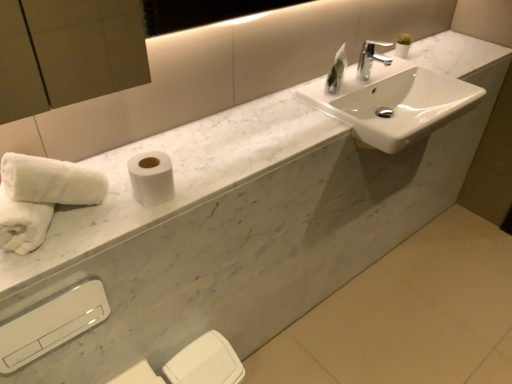
Identify the location of white marble counter top at center. coord(175,179).

In order to face white glossy hand dryer at lower left, should I rotate leftwards or rightwards?

To face it directly, rotate left by 25.039 degrees.

I want to click on white matte toilet paper at center, positioned as the 1th toilet paper in front-to-back order, so click(151, 178).

At what (x,y) coordinates should I click in order to perform the action: click on white matte toilet paper at lower center, marked as the second toilet paper in a front-to-back arrangement. Please return your answer as a coordinate pair (x, y). Looking at the image, I should click on (205, 362).

Where is `white glossy sink at upper right`? The height and width of the screenshot is (384, 512). white glossy sink at upper right is located at coordinates (394, 102).

Find the location of `chrome metallic faucet at upper center`. chrome metallic faucet at upper center is located at coordinates (371, 58).

Can you confirm if white glossy hand dryer at lower left is taller than white matte toilet paper at lower center, which is the 1th toilet paper from back to front?

No.

Who is more distant, white glossy hand dryer at lower left or white matte toilet paper at lower center, which is the 1th toilet paper from back to front?

white matte toilet paper at lower center, which is the 1th toilet paper from back to front, is more distant.

What's the angular difference between white glossy hand dryer at lower left and white matte toilet paper at lower center, the 2th toilet paper viewed from the top,'s facing directions?

The angular difference between white glossy hand dryer at lower left and white matte toilet paper at lower center, the 2th toilet paper viewed from the top, is 0.0031 degrees.

From the picture: Could you tell me if white glossy hand dryer at lower left is facing white matte toilet paper at lower center, marked as the second toilet paper in a front-to-back arrangement?

No, white glossy hand dryer at lower left is not facing towards white matte toilet paper at lower center, marked as the second toilet paper in a front-to-back arrangement.

How distant is white marble counter top at center from white fluffy towels at lower left?

The distance of white marble counter top at center from white fluffy towels at lower left is 14.55 inches.

Which object is thinner, white marble counter top at center or white fluffy towels at lower left?

With smaller width is white fluffy towels at lower left.

Which object is closer to the camera, white marble counter top at center or white fluffy towels at lower left?

white marble counter top at center is closer to the camera.

Could you tell me if white marble counter top at center is turned towards white fluffy towels at lower left?

No, white marble counter top at center is not facing towards white fluffy towels at lower left.

Is green glass vase at upper center facing away from white fluffy towels at lower left?

No, green glass vase at upper center's orientation is not away from white fluffy towels at lower left.

In the scene shown: Is white fluffy towels at lower left completely or partially inside green glass vase at upper center?

Definitely not — white fluffy towels at lower left is not inside green glass vase at upper center.

From a real-world perspective, is green glass vase at upper center physically below white fluffy towels at lower left?

No, from a real-world perspective, green glass vase at upper center is not under white fluffy towels at lower left.

From the picture: Are green glass vase at upper center and white fluffy towels at lower left beside each other?

There is a gap between green glass vase at upper center and white fluffy towels at lower left.

Which object is positioned more to the right, white fluffy towels at lower left or white matte toilet paper at center, positioned as the 1th toilet paper in front-to-back order?

Positioned to the right is white matte toilet paper at center, positioned as the 1th toilet paper in front-to-back order.

Is white fluffy towels at lower left not within white matte toilet paper at center, which ranks as the 2th toilet paper in bottom-to-top order?

white fluffy towels at lower left lies outside white matte toilet paper at center, which ranks as the 2th toilet paper in bottom-to-top order,'s area.

How many degrees apart are the facing directions of white fluffy towels at lower left and white matte toilet paper at center, the first toilet paper when ordered from top to bottom?

The facing directions of white fluffy towels at lower left and white matte toilet paper at center, the first toilet paper when ordered from top to bottom, are 35.7 degrees apart.

In the scene shown: Between white fluffy towels at lower left and white matte toilet paper at center, the first toilet paper when ordered from top to bottom, which one is positioned behind?

Positioned behind is white matte toilet paper at center, the first toilet paper when ordered from top to bottom.

Is chrome metallic faucet at upper center in front of white fluffy towels at lower left?

No.

Is white fluffy towels at lower left completely or partially inside chrome metallic faucet at upper center?

That's incorrect, white fluffy towels at lower left is not inside chrome metallic faucet at upper center.

Which object is positioned more to the right, chrome metallic faucet at upper center or white fluffy towels at lower left?

From the viewer's perspective, chrome metallic faucet at upper center appears more on the right side.

From the image's perspective, which one is positioned higher, white fluffy towels at lower left or white glossy sink at upper right?

white glossy sink at upper right.

From a real-world perspective, is white fluffy towels at lower left physically below white glossy sink at upper right?

Incorrect, from a real-world perspective, white fluffy towels at lower left is higher than white glossy sink at upper right.

Considering the sizes of objects white fluffy towels at lower left and white glossy sink at upper right in the image provided, who is smaller, white fluffy towels at lower left or white glossy sink at upper right?

With smaller size is white fluffy towels at lower left.

Considering the positions of points (6, 250) and (355, 72), is point (6, 250) closer to camera compared to point (355, 72)?

Yes, point (6, 250) is in front of point (355, 72).

From the image's perspective, is white matte toilet paper at lower center, marked as the second toilet paper in a front-to-back arrangement, beneath white glossy sink at upper right?

Yes, from the image's perspective, white matte toilet paper at lower center, marked as the second toilet paper in a front-to-back arrangement, is below white glossy sink at upper right.

Are white matte toilet paper at lower center, the 2th toilet paper viewed from the top, and white glossy sink at upper right beside each other?

No, white matte toilet paper at lower center, the 2th toilet paper viewed from the top, is not making contact with white glossy sink at upper right.

From a real-world perspective, is white matte toilet paper at lower center, marked as the second toilet paper in a front-to-back arrangement, physically below white glossy sink at upper right?

Indeed, from a real-world perspective, white matte toilet paper at lower center, marked as the second toilet paper in a front-to-back arrangement, is positioned beneath white glossy sink at upper right.

Is white matte toilet paper at lower center, placed as the 1th toilet paper when sorted from bottom to top, positioned with its back to white glossy sink at upper right?

No, white matte toilet paper at lower center, placed as the 1th toilet paper when sorted from bottom to top,'s orientation is not away from white glossy sink at upper right.

This screenshot has width=512, height=384. Identify the location of the 2nd toilet paper counting from the right of the white glossy hand dryer at lower left. (205, 362).

At what (x,y) coordinates should I click in order to perform the action: click on counter top above the white fluffy towels at lower left (from the image's perspective). Please return your answer as a coordinate pair (x, y). This screenshot has height=384, width=512. Looking at the image, I should click on (175, 179).

Consider the image. Which object lies nearer to the anchor point white glossy sink at upper right, white fluffy towels at lower left or white matte toilet paper at lower center, marked as the second toilet paper in a front-to-back arrangement?

white matte toilet paper at lower center, marked as the second toilet paper in a front-to-back arrangement, lies closer to white glossy sink at upper right than the other object.

Looking at the image, which one is located closer to white glossy hand dryer at lower left, white marble counter top at center or chrome metallic faucet at upper center?

white marble counter top at center lies closer to white glossy hand dryer at lower left than the other object.

When comparing their distances from white matte toilet paper at lower center, marked as the second toilet paper in a front-to-back arrangement, does chrome metallic faucet at upper center or white marble counter top at center seem further?

The object further to white matte toilet paper at lower center, marked as the second toilet paper in a front-to-back arrangement, is chrome metallic faucet at upper center.

From the image, which object appears to be nearer to white fluffy towels at lower left, white glossy hand dryer at lower left or white marble counter top at center?

white marble counter top at center lies closer to white fluffy towels at lower left than the other object.

Considering their positions, is chrome metallic faucet at upper center positioned closer to white glossy hand dryer at lower left than white glossy sink at upper right?

The object closer to white glossy hand dryer at lower left is white glossy sink at upper right.

Looking at the image, which one is located closer to white matte toilet paper at center, which ranks as the 2th toilet paper in bottom-to-top order, white glossy hand dryer at lower left or white glossy sink at upper right?

white glossy hand dryer at lower left lies closer to white matte toilet paper at center, which ranks as the 2th toilet paper in bottom-to-top order, than the other object.

When comparing their distances from white fluffy towels at lower left, does white matte toilet paper at center, which appears as the 2th toilet paper when viewed from the back, or chrome metallic faucet at upper center seem closer?

white matte toilet paper at center, which appears as the 2th toilet paper when viewed from the back, is positioned closer to the anchor white fluffy towels at lower left.

Looking at the image, which one is located further to white matte toilet paper at lower center, marked as the second toilet paper in a front-to-back arrangement, white matte toilet paper at center, positioned as the 1th toilet paper in front-to-back order, or chrome metallic faucet at upper center?

chrome metallic faucet at upper center is positioned further to the anchor white matte toilet paper at lower center, marked as the second toilet paper in a front-to-back arrangement.

Where is `sink between chrome metallic faucet at upper center and white matte toilet paper at lower center, marked as the second toilet paper in a front-to-back arrangement, in the vertical direction`? sink between chrome metallic faucet at upper center and white matte toilet paper at lower center, marked as the second toilet paper in a front-to-back arrangement, in the vertical direction is located at coordinates (394, 102).

This screenshot has width=512, height=384. Find the location of `hand dryer between chrome metallic faucet at upper center and white matte toilet paper at lower center, which is the 1th toilet paper from back to front, from top to bottom`. hand dryer between chrome metallic faucet at upper center and white matte toilet paper at lower center, which is the 1th toilet paper from back to front, from top to bottom is located at coordinates (52, 325).

The height and width of the screenshot is (384, 512). I want to click on sink between green glass vase at upper center and white matte toilet paper at lower center, the 2th toilet paper viewed from the top, in the up-down direction, so click(394, 102).

At what (x,y) coordinates should I click in order to perform the action: click on counter top located between white glossy hand dryer at lower left and chrome metallic faucet at upper center in the left-right direction. Please return your answer as a coordinate pair (x, y). Looking at the image, I should click on (175, 179).